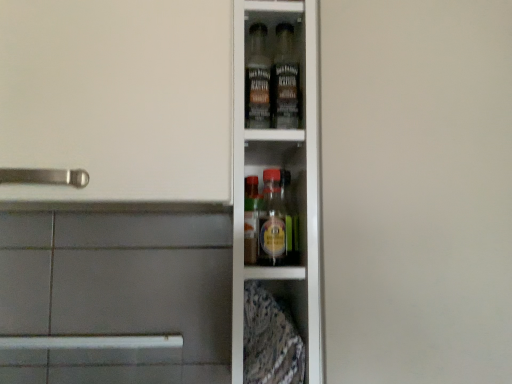
Question: Considering the relative sizes of clear glass bottles at center and transparent glass cabinet at center in the image provided, is clear glass bottles at center taller than transparent glass cabinet at center?

Choices:
 (A) no
 (B) yes

Answer: (A)

Question: Does clear glass bottles at center appear on the right side of transparent glass cabinet at center?

Choices:
 (A) no
 (B) yes

Answer: (A)

Question: Are clear glass bottles at center and transparent glass cabinet at center located far from each other?

Choices:
 (A) no
 (B) yes

Answer: (A)

Question: Is clear glass bottles at center positioned behind transparent glass cabinet at center?

Choices:
 (A) yes
 (B) no

Answer: (A)

Question: Is clear glass bottles at center wider than transparent glass cabinet at center?

Choices:
 (A) no
 (B) yes

Answer: (B)

Question: From a real-world perspective, is clear glass bottles at center beneath transparent glass cabinet at center?

Choices:
 (A) no
 (B) yes

Answer: (B)

Question: From a real-world perspective, does transparent glass cabinet at center stand above clear glass bottles at center?

Choices:
 (A) yes
 (B) no

Answer: (A)

Question: Considering the relative sizes of transparent glass cabinet at center and clear glass bottles at center in the image provided, is transparent glass cabinet at center taller than clear glass bottles at center?

Choices:
 (A) yes
 (B) no

Answer: (A)

Question: Is transparent glass cabinet at center smaller than clear glass bottles at center?

Choices:
 (A) yes
 (B) no

Answer: (A)

Question: Considering the relative positions of transparent glass cabinet at center and clear glass bottles at center in the image provided, is transparent glass cabinet at center to the left of clear glass bottles at center from the viewer's perspective?

Choices:
 (A) yes
 (B) no

Answer: (B)

Question: Is transparent glass cabinet at center next to clear glass bottles at center and touching it?

Choices:
 (A) no
 (B) yes

Answer: (A)

Question: Is transparent glass cabinet at center facing away from clear glass bottles at center?

Choices:
 (A) yes
 (B) no

Answer: (B)

Question: In terms of height, does transparent glass cabinet at center look taller or shorter compared to clear glass bottles at center?

Choices:
 (A) tall
 (B) short

Answer: (A)